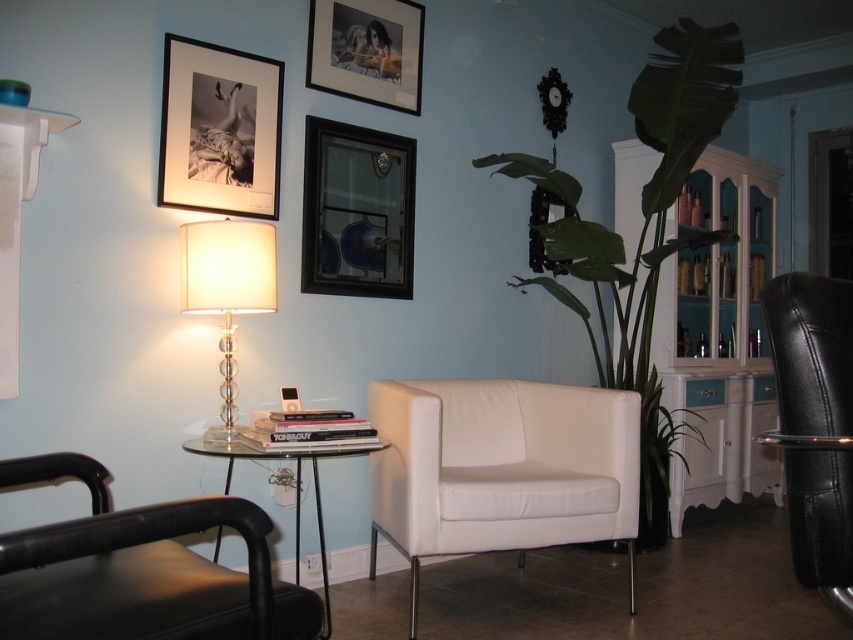
Question: Can you confirm if black leather chair at right is positioned to the left of dark wood picture frame at upper center?

Choices:
 (A) yes
 (B) no

Answer: (B)

Question: Which object is the closest to the matte black picture frame at upper center?

Choices:
 (A) clear glass table lamp at upper left
 (B) black leather swivel chair at lower left
 (C) dark wood picture frame at upper center
 (D) white leather couch at center

Answer: (C)

Question: Which of the following is the closest to the observer?

Choices:
 (A) (231, 292)
 (B) (700, 221)
 (C) (267, 64)
 (D) (271, 616)

Answer: (D)

Question: Observing the image, what is the correct spatial positioning of matte black picture frame at upper left in reference to matte black picture frame at upper center?

Choices:
 (A) left
 (B) right

Answer: (A)

Question: Considering the relative positions of black leather chair at right and clear glass table at lower left in the image provided, where is black leather chair at right located with respect to clear glass table at lower left?

Choices:
 (A) below
 (B) above

Answer: (B)

Question: Which point is farther to the camera?

Choices:
 (A) (621, 253)
 (B) (242, 445)
 (C) (780, 394)

Answer: (A)